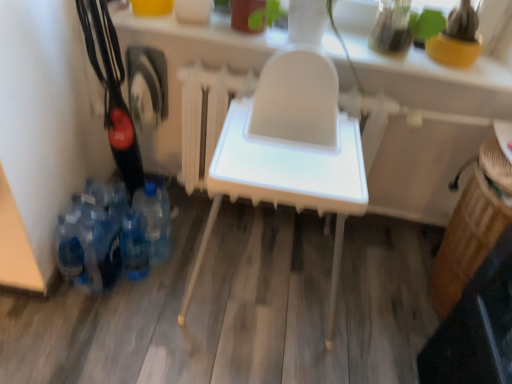
Identify the location of vacant area that lies between white plastic high chair at center and blue translucent bottle at lower left, the second bottle when ordered from right to left. This screenshot has height=384, width=512. (170, 280).